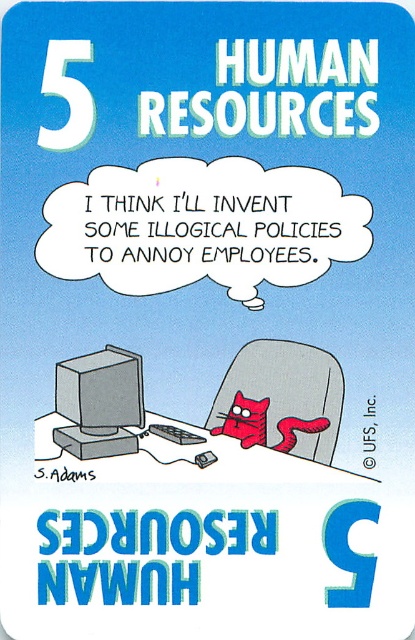
Question: Which point is closer to the camera?

Choices:
 (A) (90, 426)
 (B) (229, 387)

Answer: (A)

Question: From the image, what is the correct spatial relationship of gray fabric chair at center in relation to matte gray monitor at center?

Choices:
 (A) above
 (B) below

Answer: (B)

Question: Which object appears farthest from the camera in this image?

Choices:
 (A) gray fabric chair at center
 (B) matte gray monitor at center

Answer: (A)

Question: Which point is closer to the camera?

Choices:
 (A) matte gray monitor at center
 (B) gray fabric chair at center

Answer: (A)

Question: Considering the relative positions of gray fabric chair at center and matte gray monitor at center in the image provided, where is gray fabric chair at center located with respect to matte gray monitor at center?

Choices:
 (A) left
 (B) right

Answer: (B)

Question: Where is gray fabric chair at center located in relation to matte gray monitor at center in the image?

Choices:
 (A) below
 (B) above

Answer: (A)